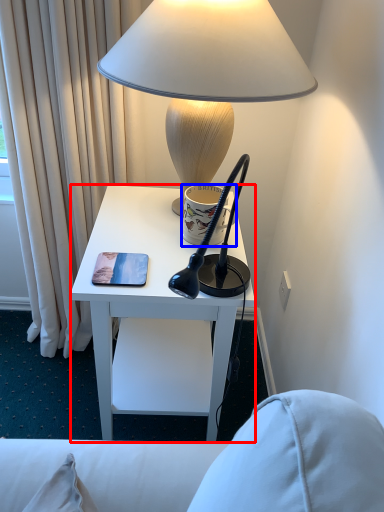
Question: Which object is further to the camera taking this photo, desk (highlighted by a red box) or coffee cup (highlighted by a blue box)?

Choices:
 (A) desk
 (B) coffee cup

Answer: (B)